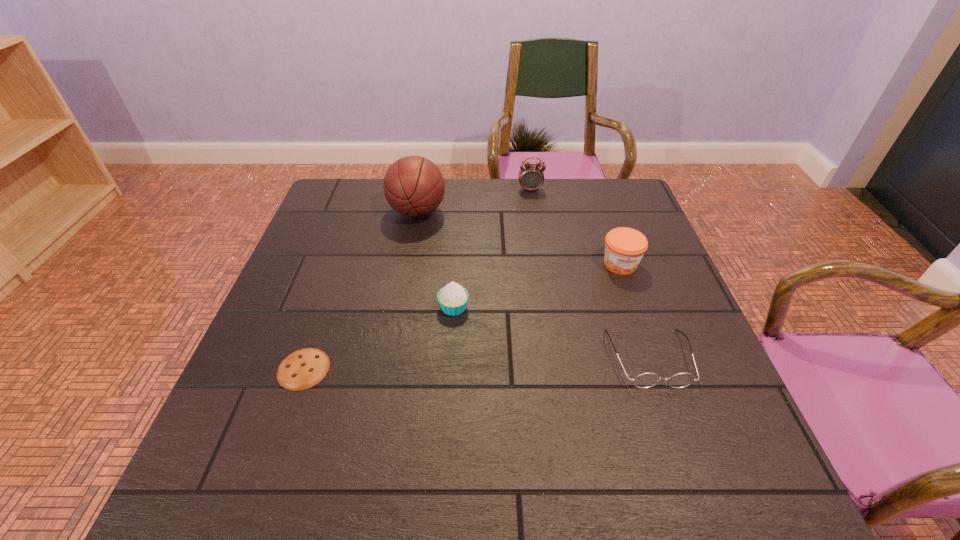
Where is `vacant space located on the front of the fifth nearest object`? vacant space located on the front of the fifth nearest object is located at coordinates (406, 274).

The image size is (960, 540). Identify the location of vacant region located 0.190m on the face of the farthest object. (537, 228).

The image size is (960, 540). Identify the location of free point located 0.250m on the front label of the jam. (653, 357).

I want to click on vacant area situated 0.150m on the right of the third nearest object, so click(x=532, y=307).

Identify the location of blank space located 0.070m through the lenses of the second shortest object. (672, 422).

Locate an element on the screen. Image resolution: width=960 pixels, height=540 pixels. vacant space located on the front of the cookie is located at coordinates (266, 477).

This screenshot has width=960, height=540. Identify the location of basketball present at the far edge. (413, 186).

Where is `alarm clock present at the far edge`? The height and width of the screenshot is (540, 960). alarm clock present at the far edge is located at coordinates (531, 176).

Identify the location of object that is at the left edge. click(x=304, y=368).

This screenshot has width=960, height=540. In order to click on jam at the right edge in this screenshot , I will do point(624,247).